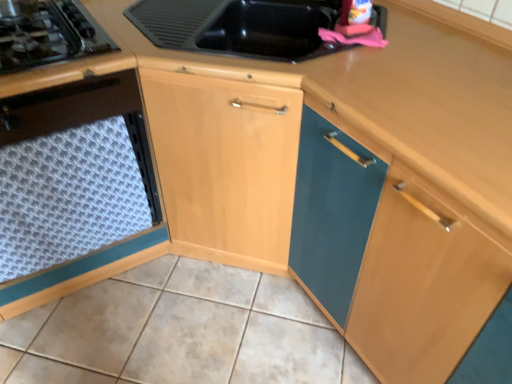
Question: Does white textured tile at lower center turn towards black glass gas stove at left?

Choices:
 (A) no
 (B) yes

Answer: (A)

Question: From the image's perspective, does white textured tile at lower center appear higher than black glass gas stove at left?

Choices:
 (A) yes
 (B) no

Answer: (B)

Question: Does white textured tile at lower center have a larger size compared to black glass gas stove at left?

Choices:
 (A) yes
 (B) no

Answer: (A)

Question: Is white textured tile at lower center turned away from black glass gas stove at left?

Choices:
 (A) no
 (B) yes

Answer: (A)

Question: Can you confirm if white textured tile at lower center is wider than black glass gas stove at left?

Choices:
 (A) yes
 (B) no

Answer: (A)

Question: Relative to wooden at upper right, is black glass gas stove at left in front or behind?

Choices:
 (A) front
 (B) behind

Answer: (B)

Question: From a real-world perspective, is black glass gas stove at left physically located above or below wooden at upper right?

Choices:
 (A) above
 (B) below

Answer: (A)

Question: In terms of height, does black glass gas stove at left look taller or shorter compared to wooden at upper right?

Choices:
 (A) short
 (B) tall

Answer: (A)

Question: Does point (75, 21) appear closer or farther from the camera than point (437, 92)?

Choices:
 (A) farther
 (B) closer

Answer: (A)

Question: Do you think white textured tile at lower center is within wooden at upper right, or outside of it?

Choices:
 (A) inside
 (B) outside

Answer: (B)

Question: Is white textured tile at lower center in front of or behind wooden at upper right in the image?

Choices:
 (A) front
 (B) behind

Answer: (B)

Question: From the image's perspective, relative to wooden at upper right, is white textured tile at lower center above or below?

Choices:
 (A) above
 (B) below

Answer: (B)

Question: Considering the positions of white textured tile at lower center and wooden at upper right in the image, is white textured tile at lower center bigger or smaller than wooden at upper right?

Choices:
 (A) big
 (B) small

Answer: (B)

Question: Considering the positions of white textured tile at lower center and white textured mat at lower left in the image, is white textured tile at lower center taller or shorter than white textured mat at lower left?

Choices:
 (A) tall
 (B) short

Answer: (B)

Question: Considering their positions, is white textured tile at lower center located in front of or behind white textured mat at lower left?

Choices:
 (A) front
 (B) behind

Answer: (B)